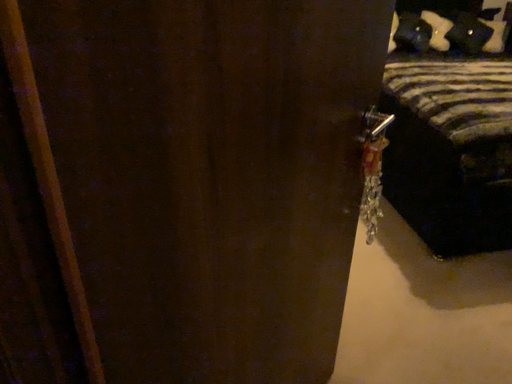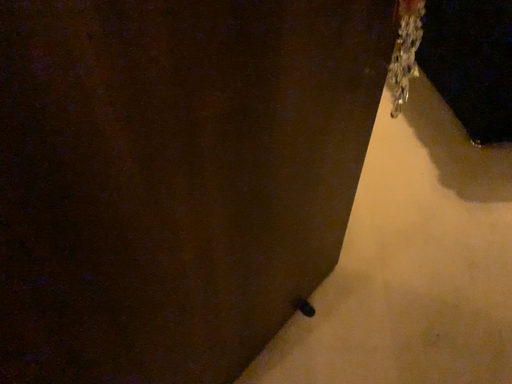
Question: Which way did the camera rotate in the video?

Choices:
 (A) rotated upward
 (B) rotated downward

Answer: (B)